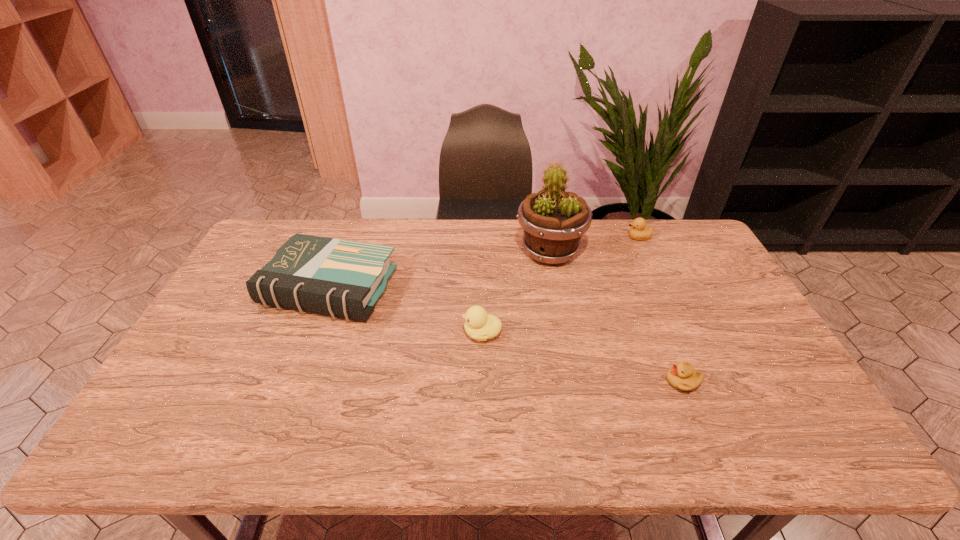
Identify which object is located as the nearest to the shortest duckling. Please provide its 2D coordinates. Your answer should be formatted as a tuple, i.e. [(x, y)], where the tuple contains the x and y coordinates of a point satisfying the conditions above.

[(553, 221)]

Select which object is the closest to the paperback book. Please provide its 2D coordinates. Your answer should be formatted as a tuple, i.e. [(x, y)], where the tuple contains the x and y coordinates of a point satisfying the conditions above.

[(479, 325)]

I want to click on duckling that is the second closest one to the nearest object, so click(x=638, y=231).

Locate an element on the screen. the second closest duckling to the third object from left to right is located at coordinates (479, 325).

Where is `vacant position in the image that satisfies the following two spatial constraints: 1. facing forward on the second shortest object; 2. on the front side of the tallest object`? This screenshot has width=960, height=540. vacant position in the image that satisfies the following two spatial constraints: 1. facing forward on the second shortest object; 2. on the front side of the tallest object is located at coordinates (645, 252).